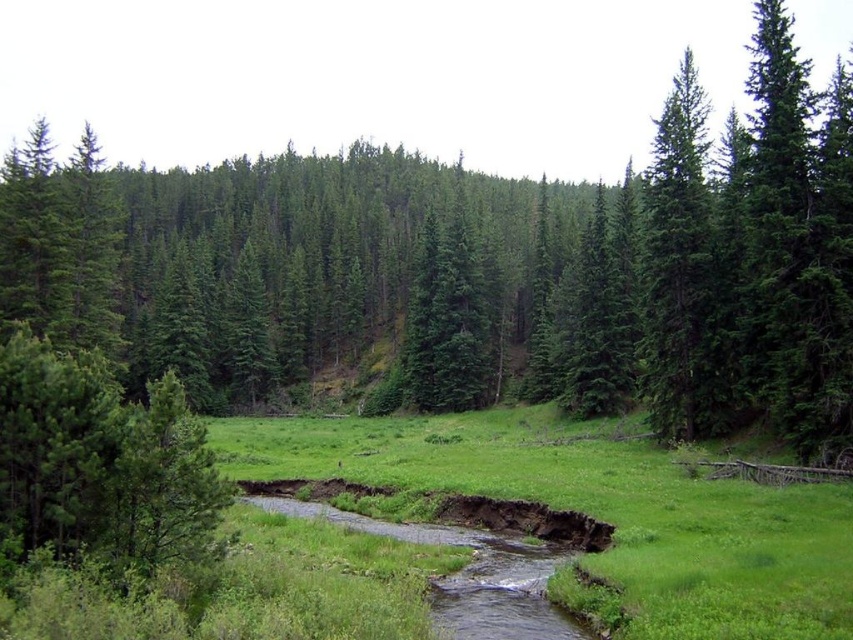
Which is in front, point (285, 451) or point (677, 257)?

Point (677, 257) is in front.

Which is behind, point (692, 550) or point (648, 221)?

Point (648, 221)

Where is `green grassy field at center`? green grassy field at center is located at coordinates (595, 513).

I want to click on green grassy field at center, so click(595, 513).

Image resolution: width=853 pixels, height=640 pixels. What do you see at coordinates (477, 268) in the screenshot?
I see `green matte tree at center` at bounding box center [477, 268].

Is green matte tree at center in front of green grassy field at center?

No, it is behind green grassy field at center.

Does point (770, 308) come behind point (403, 461)?

No, (770, 308) is in front of (403, 461).

Identify the location of green matte tree at center. (477, 268).

Which is more to the left, green matte tree at center or green matte tree at right?

green matte tree at right is more to the left.

Based on the photo, does green matte tree at center appear over green matte tree at right?

Yes.

Does point (97, 262) come closer to viewer compared to point (672, 260)?

No, it is not.

In order to click on green matte tree at center in this screenshot , I will do `click(477, 268)`.